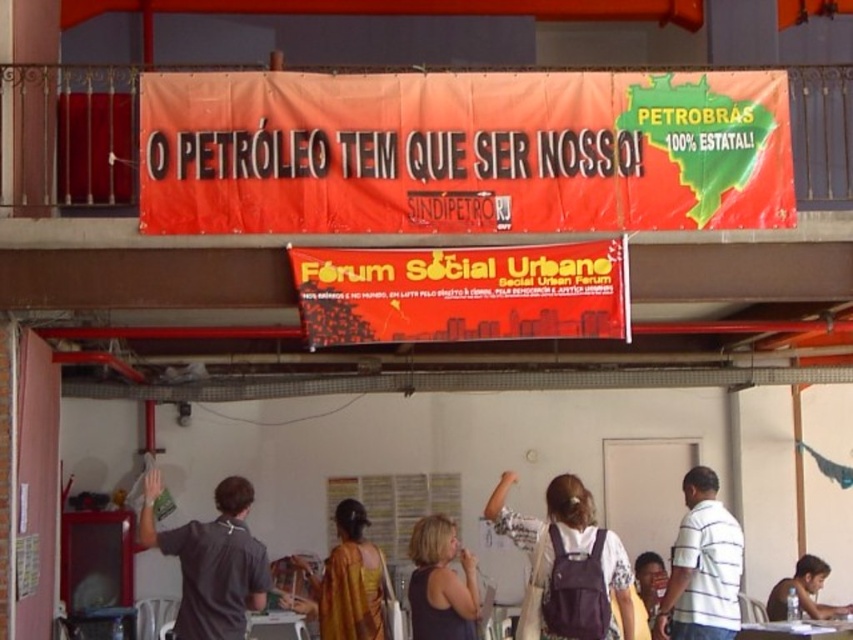
You are an attendee at this event and want to place your white fabric backpack at center on the floor near the dark gray shirt at upper left. Is the backpack currently closer to you than the shirt?

The white fabric backpack at center is closer to the viewer than the dark gray shirt at upper left, so yes, the backpack is closer to you than the shirt.